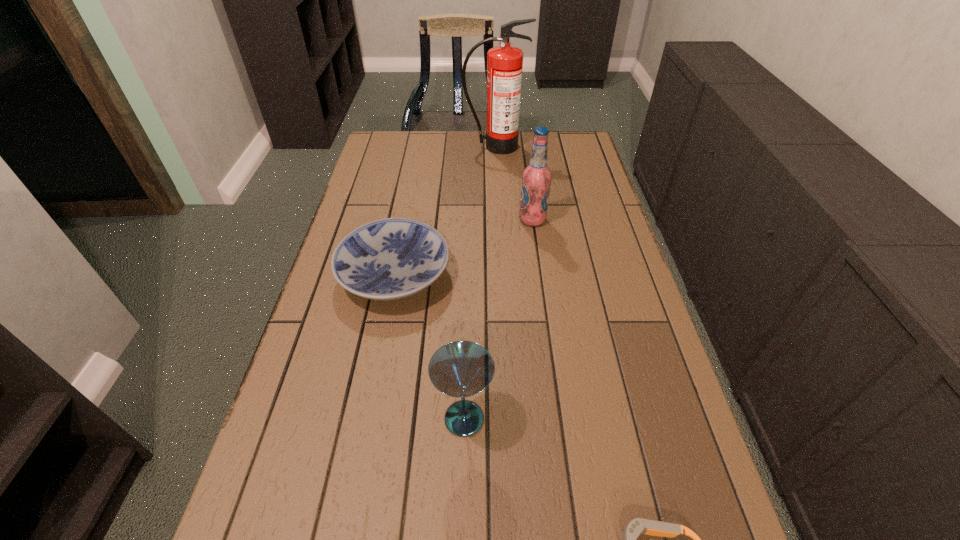
At what (x,y) coordinates should I click in order to perform the action: click on free space located 0.300m on the back of the second nearest object. Please return your answer as a coordinate pair (x, y). The image size is (960, 540). Looking at the image, I should click on (468, 288).

This screenshot has width=960, height=540. Find the location of `vacant space located on the right of the plate`. vacant space located on the right of the plate is located at coordinates click(580, 275).

Identify the location of object at the far edge. The height and width of the screenshot is (540, 960). (504, 63).

Where is `object present at the left edge`? The height and width of the screenshot is (540, 960). object present at the left edge is located at coordinates (393, 258).

Identify the location of free space at the far edge of the desktop. (509, 163).

This screenshot has height=540, width=960. I want to click on vacant space at the left edge, so click(324, 488).

I want to click on vacant space at the right edge of the desktop, so click(x=641, y=382).

This screenshot has width=960, height=540. In the image, there is a desktop. Identify the location of blank space at the far left corner. (396, 163).

At what (x,y) coordinates should I click in order to perform the action: click on free spot between the alcohol and the farthest object. Please return your answer as a coordinate pair (x, y). This screenshot has height=540, width=960. Looking at the image, I should click on (514, 183).

You are a GUI agent. You are given a task and a screenshot of the screen. Output one action in this format:
    pyautogui.click(x=<x>, y=<y>)
    Task: Click on the unoccupied area between the third shortest object and the alcohol
    This screenshot has height=540, width=960.
    Given the screenshot: What is the action you would take?
    pyautogui.click(x=498, y=319)